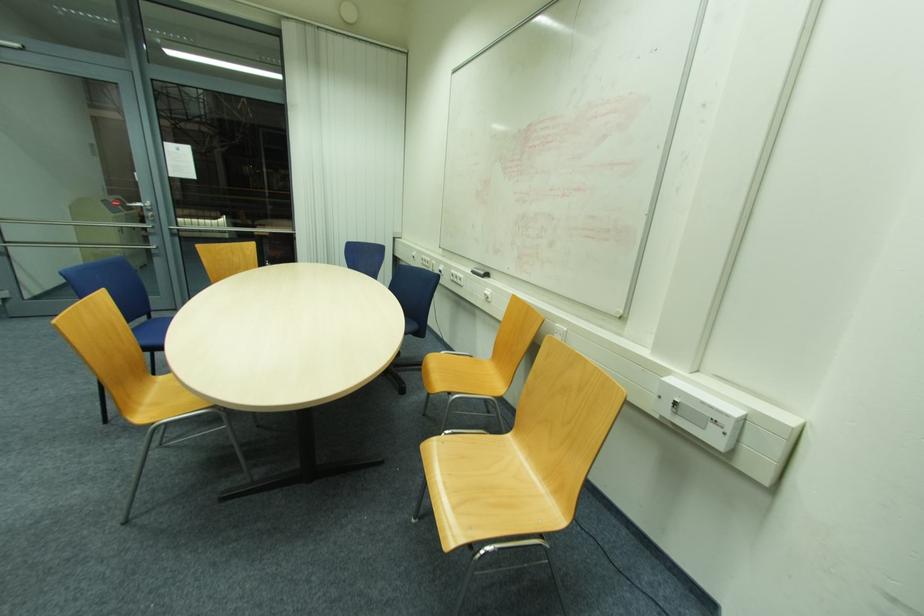
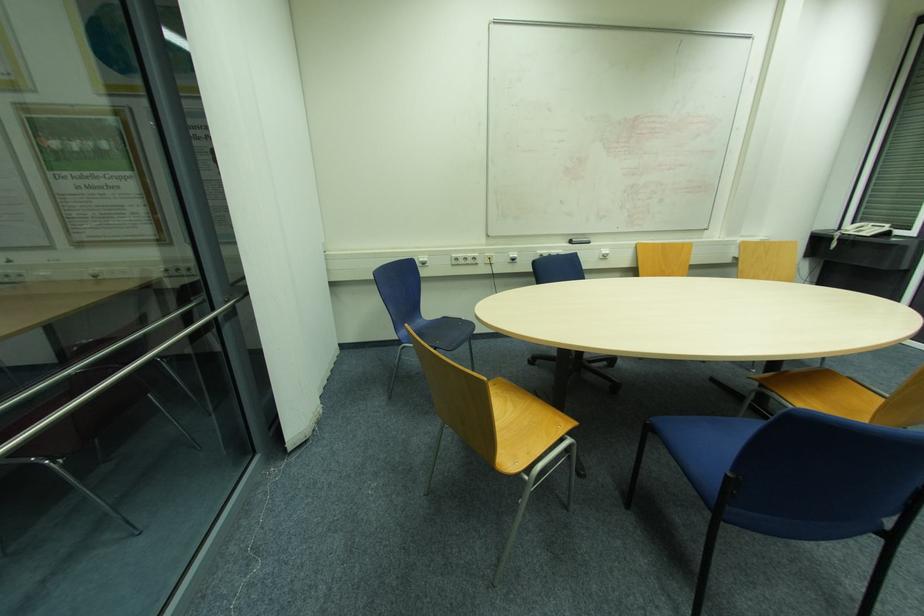
Where in the second image is the point corresponding to point (427, 261) from the first image?

(467, 259)